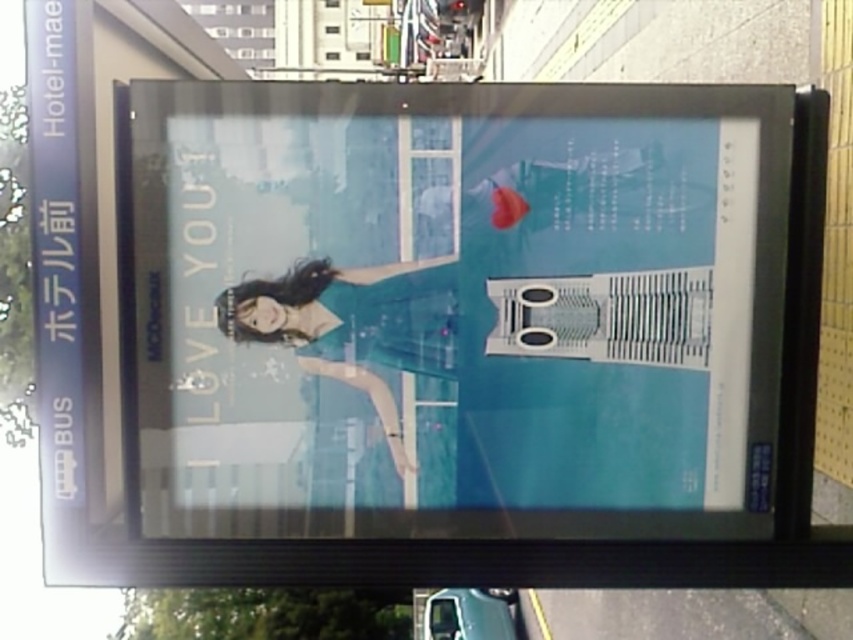
Is point (305, 116) positioned in front of point (289, 310)?

Yes.

In the scene shown: Does matte blue poster at center lie behind matte teal dress at center?

No, matte blue poster at center is in front of matte teal dress at center.

Locate an element on the screen. Image resolution: width=853 pixels, height=640 pixels. matte blue poster at center is located at coordinates [x=457, y=308].